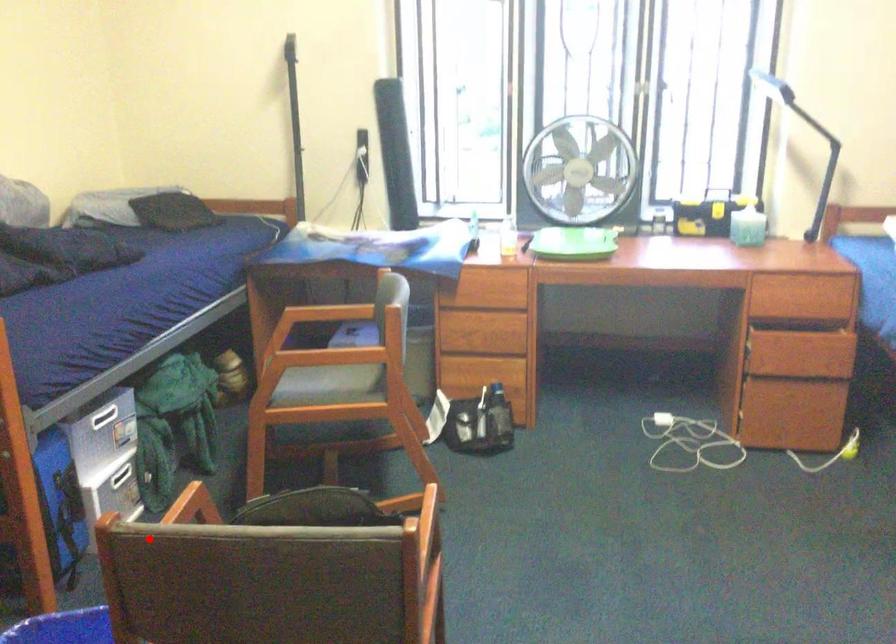
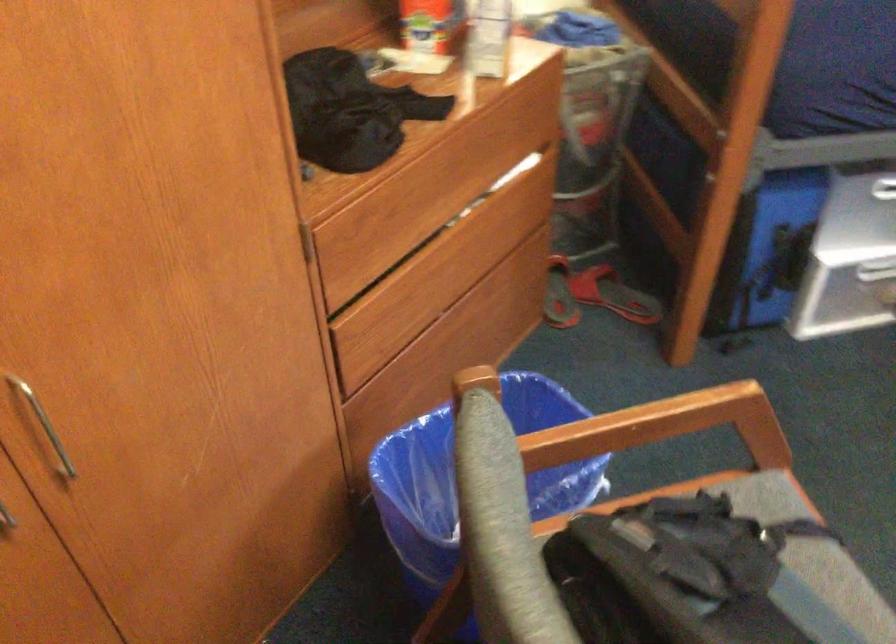
Question: A red point is marked in image1. In image2, is the corresponding 3D point closer to the camera or farther? Reply with the corresponding letter.

Choices:
 (A) The corresponding 3D point is closer.
 (B) The corresponding 3D point is farther.

Answer: (A)